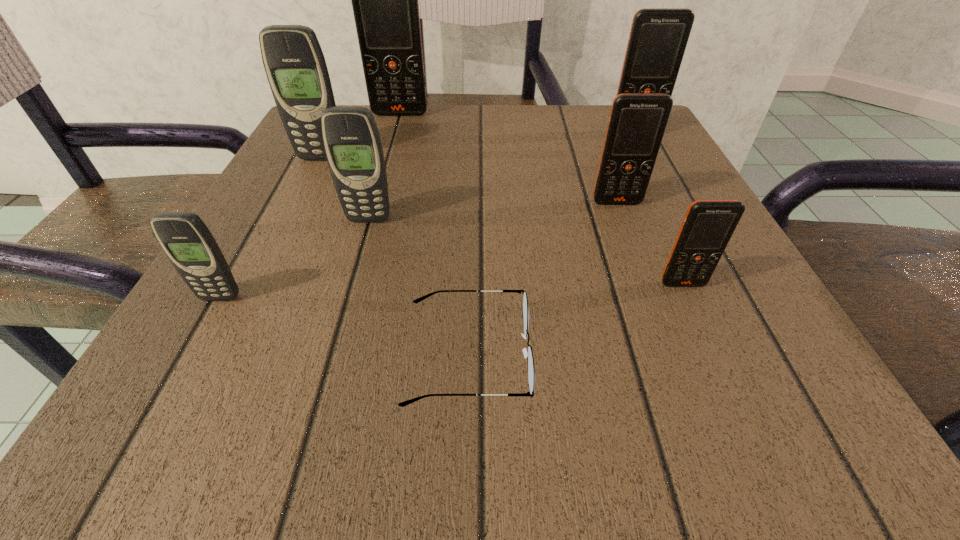
This screenshot has height=540, width=960. I want to click on cellular telephone that stands as the closest to the black spectacles, so click(351, 139).

You are a GUI agent. You are given a task and a screenshot of the screen. Output one action in this format:
    pyautogui.click(x=<x>, y=<y>)
    Task: Click on the sixth closest cellular telephone relative to the second farthest object
    Image resolution: width=960 pixels, height=540 pixels.
    Given the screenshot: What is the action you would take?
    [x=188, y=243]

Where is `orange cellular telephone that is the closest one to the biggest gray cellular telephone`? orange cellular telephone that is the closest one to the biggest gray cellular telephone is located at coordinates (385, 4).

Locate which orange cellular telephone is the closest to the second nearest cellular telephone. Please provide its 2D coordinates. Your answer should be formatted as a tuple, i.e. [(x, y)], where the tuple contains the x and y coordinates of a point satisfying the conditions above.

[(637, 123)]

Image resolution: width=960 pixels, height=540 pixels. Find the location of `the second closest gray cellular telephone to the sixth nearest object`. the second closest gray cellular telephone to the sixth nearest object is located at coordinates (188, 243).

Locate which gray cellular telephone is the closest to the black spectacles. Please provide its 2D coordinates. Your answer should be formatted as a tuple, i.e. [(x, y)], where the tuple contains the x and y coordinates of a point satisfying the conditions above.

[(351, 139)]

Image resolution: width=960 pixels, height=540 pixels. I want to click on free space that satisfies the following two spatial constraints: 1. on the screen of the third nearest orange cellular telephone; 2. on the lenses of the black spectacles, so click(750, 355).

Where is `free space that satisfies the following two spatial constraints: 1. on the screen of the third nearest object; 2. on the lenses of the shortest object`? The height and width of the screenshot is (540, 960). free space that satisfies the following two spatial constraints: 1. on the screen of the third nearest object; 2. on the lenses of the shortest object is located at coordinates (715, 355).